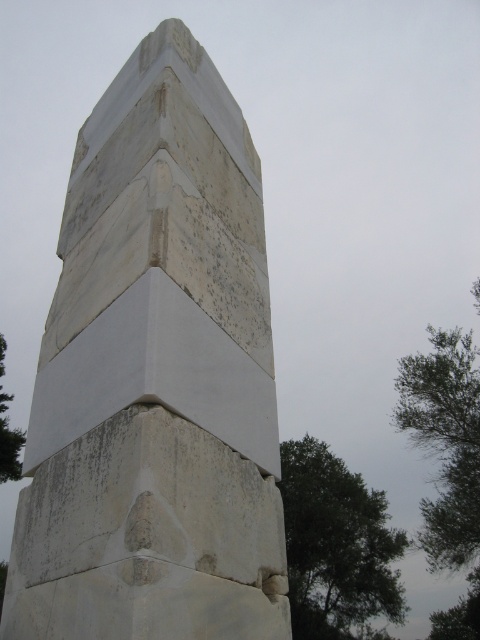
You are standing in front of the monument and want to walk towards the green leafy tree at upper right and the green leafy tree at lower left. Which tree will you reach first?

You will reach the green leafy tree at upper right first because it is closer to you than the green leafy tree at lower left, which is further away.